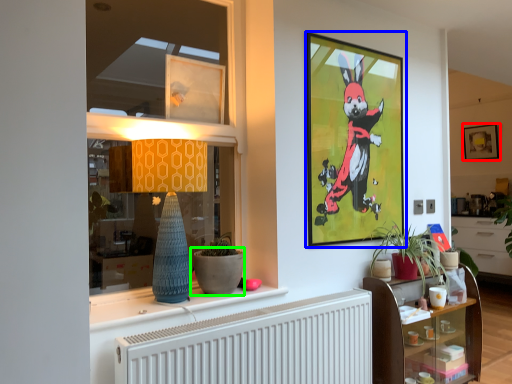
Question: Based on their relative distances, which object is farther from picture frame (highlighted by a red box)? Choose from picture frame (highlighted by a blue box) and flowerpot (highlighted by a green box).

Choices:
 (A) picture frame
 (B) flowerpot

Answer: (B)